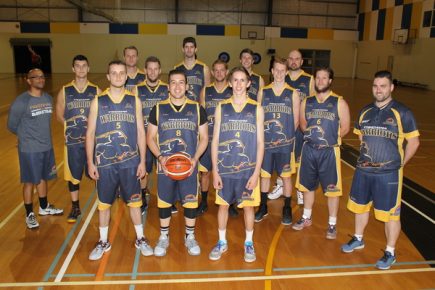
The width and height of the screenshot is (435, 290). What are the coordinates of `shiny brown gym floor` in the screenshot? It's located at (45, 261).